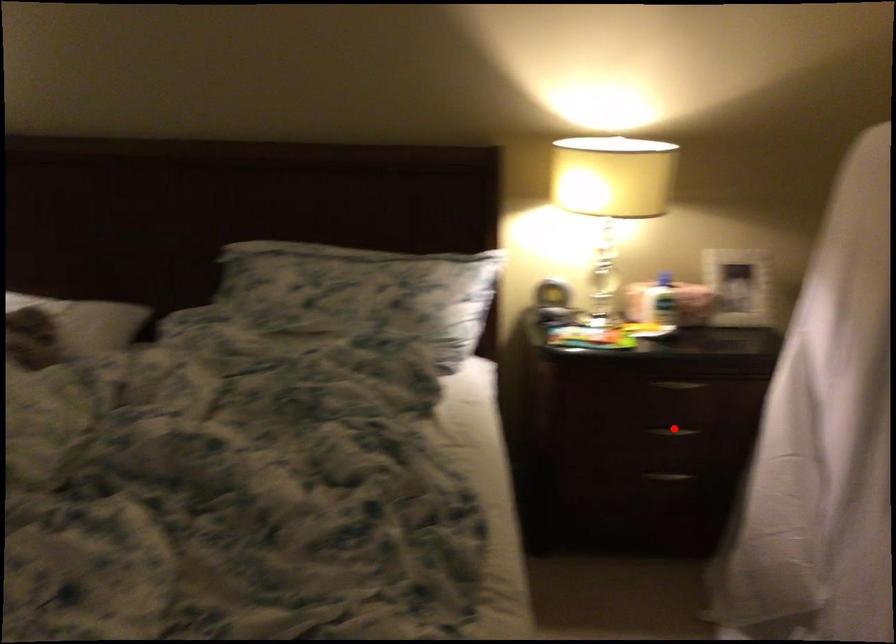
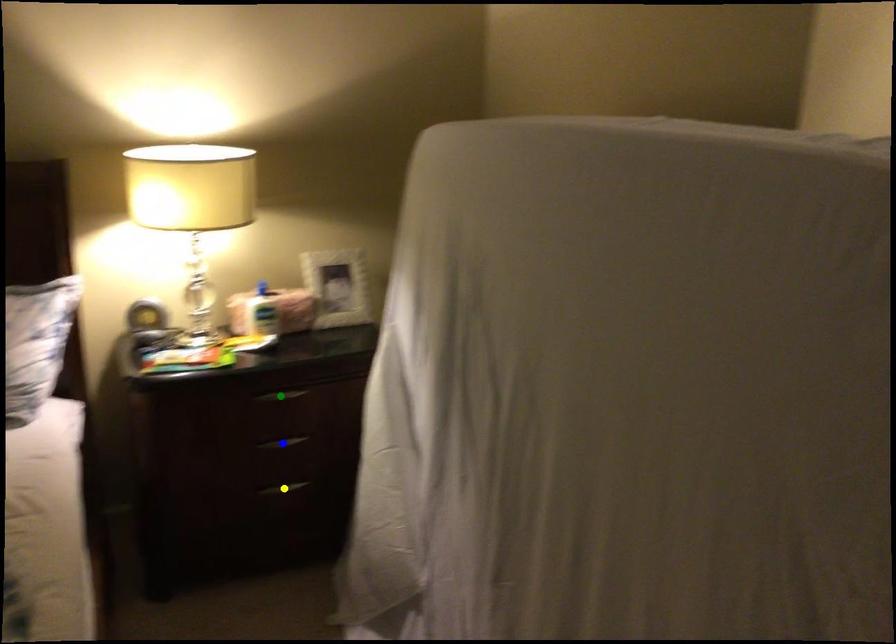
Question: I am providing you with two images of the same scene from different viewpoints. A red point is marked on the first image. You are given multiple points on the second image. Which point in image 2 represents the same 3d spot as the red point in image 1?

Choices:
 (A) yellow point
 (B) green point
 (C) blue point

Answer: (C)